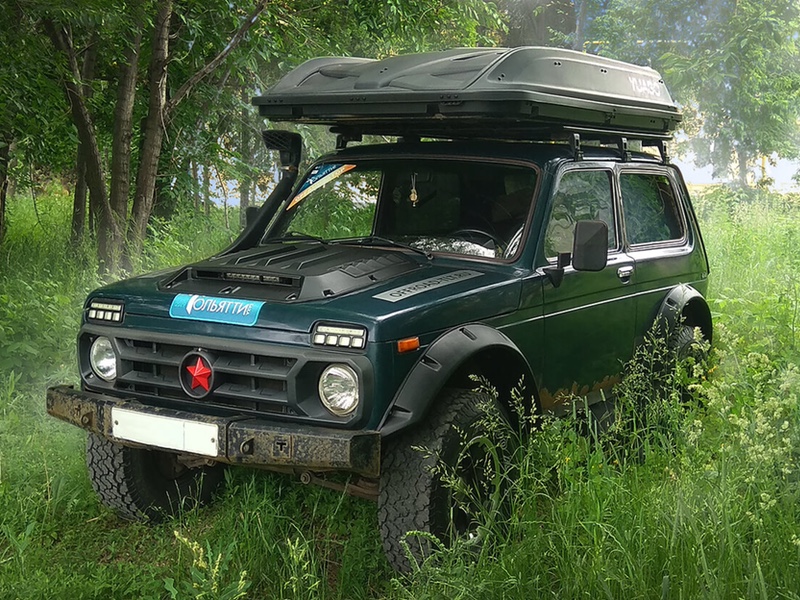
Find the location of a particular element. This screenshot has width=800, height=600. storage is located at coordinates (473, 91).